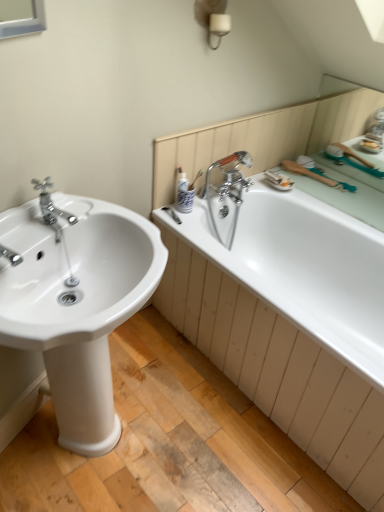
Question: Does white glossy sink at left contain polished chrome faucet at left?

Choices:
 (A) yes
 (B) no

Answer: (A)

Question: From the image's perspective, is white glossy sink at left on polished chrome faucet at left?

Choices:
 (A) yes
 (B) no

Answer: (B)

Question: Is white glossy sink at left at the left side of polished chrome faucet at left?

Choices:
 (A) no
 (B) yes

Answer: (A)

Question: Is white glossy sink at left to the right of polished chrome faucet at left from the viewer's perspective?

Choices:
 (A) no
 (B) yes

Answer: (B)

Question: Does white glossy sink at left have a lesser width compared to polished chrome faucet at left?

Choices:
 (A) yes
 (B) no

Answer: (B)

Question: Considering the positions of white glossy sink at left and white glossy bathtub at right in the image, is white glossy sink at left taller or shorter than white glossy bathtub at right?

Choices:
 (A) tall
 (B) short

Answer: (A)

Question: Does point (137, 230) appear closer or farther from the camera than point (354, 365)?

Choices:
 (A) farther
 (B) closer

Answer: (B)

Question: In the image, is white glossy sink at left positioned in front of or behind white glossy bathtub at right?

Choices:
 (A) behind
 (B) front

Answer: (B)

Question: Considering the positions of white glossy sink at left and white glossy bathtub at right in the image, is white glossy sink at left wider or thinner than white glossy bathtub at right?

Choices:
 (A) thin
 (B) wide

Answer: (A)

Question: Considering the relative positions of polished chrome faucet at left and white glossy bathtub at right in the image provided, is polished chrome faucet at left to the left or to the right of white glossy bathtub at right?

Choices:
 (A) right
 (B) left

Answer: (B)

Question: Is polished chrome faucet at left wider or thinner than white glossy bathtub at right?

Choices:
 (A) wide
 (B) thin

Answer: (B)

Question: From the image's perspective, relative to white glossy bathtub at right, is polished chrome faucet at left above or below?

Choices:
 (A) above
 (B) below

Answer: (A)

Question: Looking at the image, does polished chrome faucet at left seem bigger or smaller compared to white glossy bathtub at right?

Choices:
 (A) big
 (B) small

Answer: (B)

Question: Is white glossy bathtub at right taller or shorter than white glossy sink at left?

Choices:
 (A) short
 (B) tall

Answer: (A)

Question: Relative to white glossy sink at left, is white glossy bathtub at right in front or behind?

Choices:
 (A) front
 (B) behind

Answer: (B)